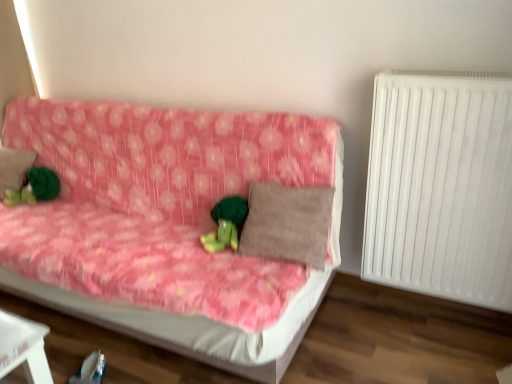
Question: Is white plastic radiator at right in front of or behind brown fabric pillow at left, arranged as the first pillow when viewed from the back, in the image?

Choices:
 (A) behind
 (B) front

Answer: (B)

Question: In terms of size, does white plastic radiator at right appear bigger or smaller than brown fabric pillow at left, the second pillow when ordered from right to left?

Choices:
 (A) small
 (B) big

Answer: (B)

Question: Which object is positioned farthest from the pink floral fabric couch at center?

Choices:
 (A) white plastic radiator at right
 (B) green plush toy at left, the second toy in the front-to-back sequence
 (C) brown fabric pillow at left, the second pillow when ordered from right to left
 (D) brown textured pillow at center, which is the 2th pillow in back-to-front order
 (E) green plush toy at center, positioned as the 2th toy in left-to-right order

Answer: (C)

Question: Which of these objects is positioned closest to the brown textured pillow at center, marked as the 1th pillow in a right-to-left arrangement?

Choices:
 (A) white plastic radiator at right
 (B) brown fabric pillow at left, the second pillow when ordered from right to left
 (C) green plush toy at left, which appears as the 1th toy when viewed from the back
 (D) pink floral fabric couch at center
 (E) green plush toy at center, which is the 1th toy from right to left

Answer: (E)